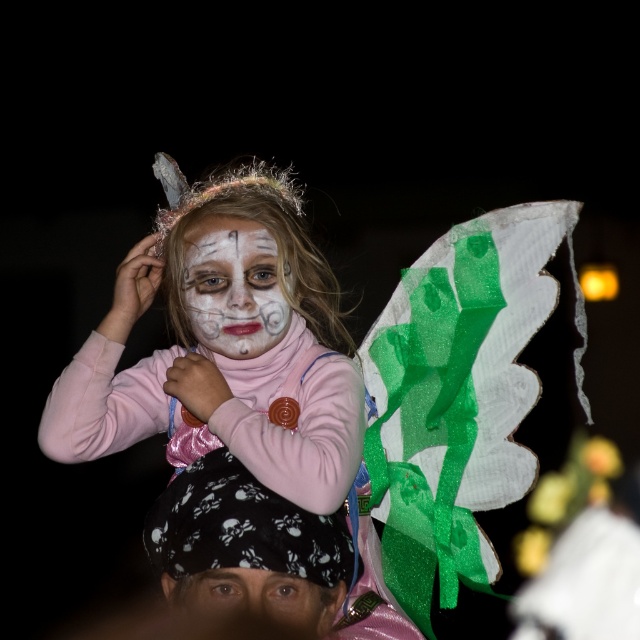
Does point (227, 269) come farther from viewer compared to point (304, 600)?

Yes, point (227, 269) is behind point (304, 600).

Is white matte face paint at center closer to camera compared to smooth skin eyes at center?

No.

At what (x,y) coordinates should I click in order to perform the action: click on white matte face paint at center. Please return your answer as a coordinate pair (x, y). This screenshot has width=640, height=640. Looking at the image, I should click on (234, 285).

Between matte pink sweater at center and smooth skin eyes at center, which one appears on the right side from the viewer's perspective?

smooth skin eyes at center

I want to click on matte pink sweater at center, so click(225, 344).

The height and width of the screenshot is (640, 640). I want to click on matte pink sweater at center, so click(225, 344).

Looking at this image, which of these two, matte pink sweater at center or white matte face paint at center, stands taller?

Standing taller between the two is matte pink sweater at center.

Consider the image. Is matte pink sweater at center above white matte face paint at center?

Incorrect, matte pink sweater at center is not positioned above white matte face paint at center.

Measure the distance between matte pink sweater at center and camera.

matte pink sweater at center is 2.58 meters from camera.

This screenshot has width=640, height=640. Find the location of `matte pink sweater at center`. matte pink sweater at center is located at coordinates (x=225, y=344).